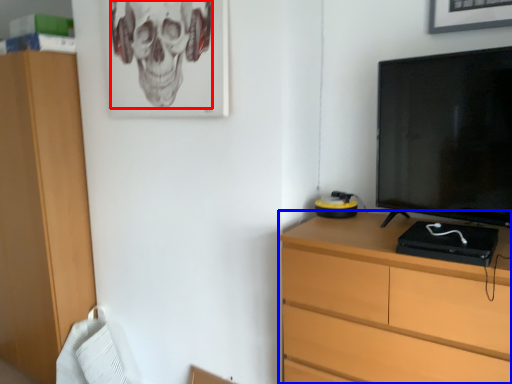
Question: Which point is further to the camera, skull (highlighted by a red box) or chest of drawers (highlighted by a blue box)?

Choices:
 (A) skull
 (B) chest of drawers

Answer: (A)